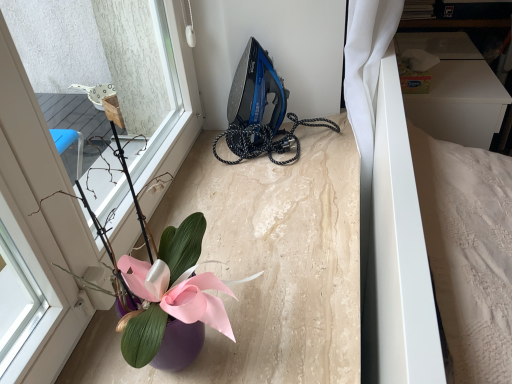
Question: From the image's perspective, is purple glossy vase at lower left above or below white matte bed at right?

Choices:
 (A) below
 (B) above

Answer: (A)

Question: In the image, is purple glossy vase at lower left on the left side or the right side of white matte bed at right?

Choices:
 (A) right
 (B) left

Answer: (B)

Question: Estimate the real-world distances between objects in this image. Which object is closer to the blue glossy iron at upper center?

Choices:
 (A) purple glossy vase at lower left
 (B) white matte bed at right

Answer: (B)

Question: Estimate the real-world distances between objects in this image. Which object is closer to the blue glossy iron at upper center?

Choices:
 (A) white matte bed at right
 (B) purple glossy vase at lower left

Answer: (A)